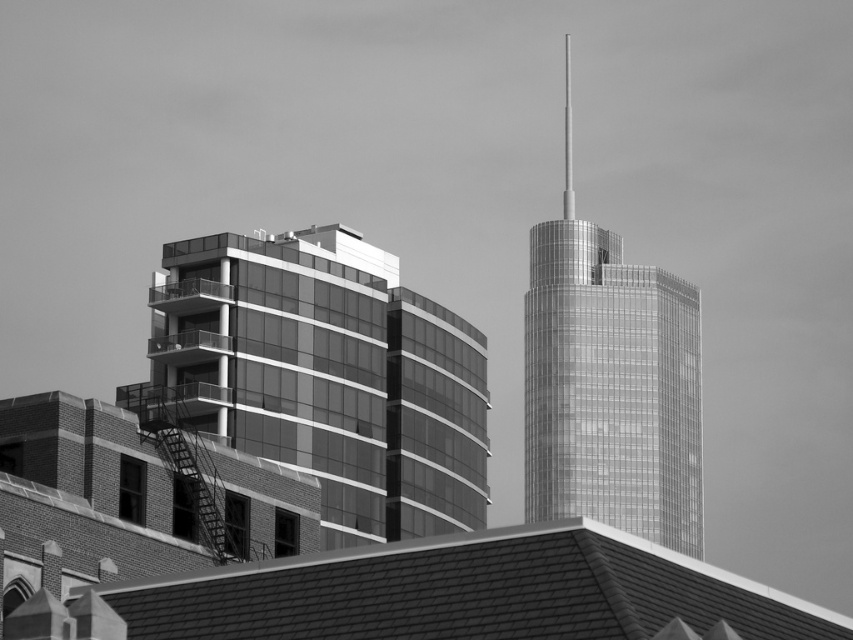
Describe the element at coordinates (329, 376) in the screenshot. The width and height of the screenshot is (853, 640). I see `glassy reflective building at center-left` at that location.

Is the position of glassy reflective building at center-left less distant than that of glassy metallic skyscraper at center?

Yes, glassy reflective building at center-left is closer to the viewer.

Between point (398, 488) and point (643, 356), which one is positioned in front?

Point (398, 488)

Locate an element on the screen. glassy reflective building at center-left is located at coordinates (329, 376).